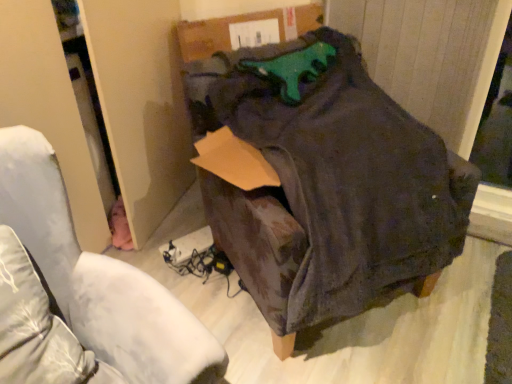
You are a GUI agent. You are given a task and a screenshot of the screen. Output one action in this format:
    pyautogui.click(x=<x>, y=<y>)
    Task: Click on the dark gray suede bean bag chair at center
    The height and width of the screenshot is (384, 512).
    Given the screenshot: What is the action you would take?
    pyautogui.click(x=325, y=182)

This screenshot has width=512, height=384. Describe the element at coordinates (325, 182) in the screenshot. I see `dark gray suede bean bag chair at center` at that location.

The height and width of the screenshot is (384, 512). I want to click on dark fabric bag at center, so click(x=99, y=278).

Describe the element at coordinates (99, 278) in the screenshot. The image size is (512, 384). I see `dark fabric bag at center` at that location.

The image size is (512, 384). I want to click on dark gray suede bean bag chair at center, so click(x=325, y=182).

Between dark fabric bag at center and dark gray suede bean bag chair at center, which one appears on the right side from the viewer's perspective?

dark gray suede bean bag chair at center is more to the right.

Which is in front, dark fabric bag at center or dark gray suede bean bag chair at center?

Positioned in front is dark fabric bag at center.

Is point (207, 341) less distant than point (201, 124)?

Yes.

From the image's perspective, who appears lower, dark fabric bag at center or dark gray suede bean bag chair at center?

From the image's view, dark fabric bag at center is below.

From a real-world perspective, is dark fabric bag at center over dark gray suede bean bag chair at center?

Incorrect, from a real-world perspective, dark fabric bag at center is lower than dark gray suede bean bag chair at center.

Which of these two, dark fabric bag at center or dark gray suede bean bag chair at center, is thinner?

Thinner between the two is dark fabric bag at center.

Is dark fabric bag at center taller or shorter than dark gray suede bean bag chair at center?

dark fabric bag at center is taller than dark gray suede bean bag chair at center.

From the picture: Looking at the image, does dark fabric bag at center seem bigger or smaller compared to dark gray suede bean bag chair at center?

Clearly, dark fabric bag at center is smaller in size than dark gray suede bean bag chair at center.

Would you say dark fabric bag at center is inside or outside dark gray suede bean bag chair at center?

dark fabric bag at center exists outside the volume of dark gray suede bean bag chair at center.

Is dark fabric bag at center positioned far away from dark gray suede bean bag chair at center?

They are positioned close to each other.

Is dark fabric bag at center looking in the opposite direction of dark gray suede bean bag chair at center?

No, dark fabric bag at center is not facing the opposite direction of dark gray suede bean bag chair at center.

How many degrees apart are the facing directions of dark fabric bag at center and dark gray suede bean bag chair at center?

The angle between the facing direction of dark fabric bag at center and the facing direction of dark gray suede bean bag chair at center is 16.9 degrees.

Identify the location of furniture to the left of dark gray suede bean bag chair at center. (99, 278).

Does dark gray suede bean bag chair at center appear on the left side of dark fabric bag at center?

No.

Which is behind, dark gray suede bean bag chair at center or dark fabric bag at center?

dark gray suede bean bag chair at center.

Is point (189, 107) closer to camera compared to point (50, 234)?

No, (189, 107) is behind (50, 234).

From the image's perspective, relative to dark fabric bag at center, is dark gray suede bean bag chair at center above or below?

dark gray suede bean bag chair at center is above dark fabric bag at center.

From a real-world perspective, between dark gray suede bean bag chair at center and dark fabric bag at center, who is vertically higher?

From a 3D spatial view, dark gray suede bean bag chair at center is above.

Which of these two, dark gray suede bean bag chair at center or dark fabric bag at center, is thinner?

dark fabric bag at center is thinner.

Considering the sizes of dark gray suede bean bag chair at center and dark fabric bag at center in the image, is dark gray suede bean bag chair at center taller or shorter than dark fabric bag at center?

Clearly, dark gray suede bean bag chair at center is shorter compared to dark fabric bag at center.

Considering the sizes of objects dark gray suede bean bag chair at center and dark fabric bag at center in the image provided, who is smaller, dark gray suede bean bag chair at center or dark fabric bag at center?

With smaller size is dark fabric bag at center.

Does dark gray suede bean bag chair at center contain dark fabric bag at center?

That's incorrect, dark fabric bag at center is not inside dark gray suede bean bag chair at center.

Is dark gray suede bean bag chair at center positioned far away from dark fabric bag at center?

That's not correct — dark gray suede bean bag chair at center is a little close to dark fabric bag at center.

Is dark gray suede bean bag chair at center oriented away from dark fabric bag at center?

No, dark gray suede bean bag chair at center's orientation is not away from dark fabric bag at center.

How much distance is there between dark gray suede bean bag chair at center and dark fabric bag at center?

dark gray suede bean bag chair at center is 23.81 inches from dark fabric bag at center.

Image resolution: width=512 pixels, height=384 pixels. In order to click on bean bag chair behind the dark fabric bag at center in this screenshot , I will do `click(325, 182)`.

What are the coordinates of `furniture directly beneath the dark gray suede bean bag chair at center (from a real-world perspective)` in the screenshot? It's located at (99, 278).

Where is `furniture on the left side of dark gray suede bean bag chair at center`? furniture on the left side of dark gray suede bean bag chair at center is located at coordinates (99, 278).